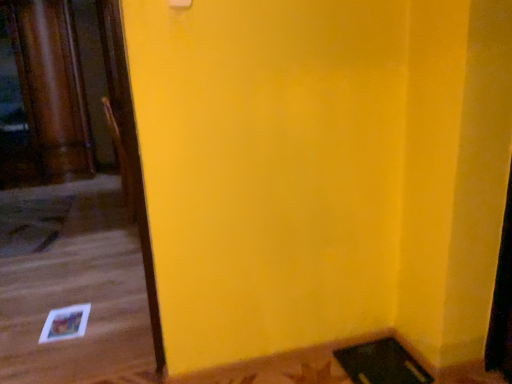
Identify the location of rug at lower left. (31, 223).

The width and height of the screenshot is (512, 384). What do you see at coordinates (31, 223) in the screenshot? I see `rug at lower left` at bounding box center [31, 223].

Looking at this image, what is the approximate height of wooden chair at left?

It is 38.28 inches.

This screenshot has width=512, height=384. Describe the element at coordinates (121, 160) in the screenshot. I see `wooden chair at left` at that location.

The image size is (512, 384). I want to click on wooden chair at left, so click(121, 160).

Measure the distance between point (x=131, y=209) and camera.

The distance of point (x=131, y=209) from camera is 3.31 meters.

Where is `rug at lower left`? rug at lower left is located at coordinates (31, 223).

Considering the relative positions of wooden chair at left and rug at lower left in the image provided, is wooden chair at left to the left of rug at lower left from the viewer's perspective?

Incorrect, wooden chair at left is not on the left side of rug at lower left.

Which is in front, wooden chair at left or rug at lower left?

Positioned in front is rug at lower left.

Which is behind, point (123, 171) or point (47, 214)?

The point (47, 214) is farther from the camera.

Based on the photo, from the image's perspective, is wooden chair at left above rug at lower left?

Yes, from the image's perspective, wooden chair at left is on top of rug at lower left.

Consider the image. From a real-world perspective, who is located higher, wooden chair at left or rug at lower left?

From a 3D spatial view, wooden chair at left is above.

Between wooden chair at left and rug at lower left, which one has larger width?

rug at lower left is wider.

Who is taller, wooden chair at left or rug at lower left?

wooden chair at left is taller.

Considering the sizes of objects wooden chair at left and rug at lower left in the image provided, who is bigger, wooden chair at left or rug at lower left?

Bigger between the two is wooden chair at left.

Is wooden chair at left not within rug at lower left?

Yes, wooden chair at left is outside of rug at lower left.

Is wooden chair at left next to rug at lower left?

wooden chair at left and rug at lower left are not in contact.

Is rug at lower left at the back of wooden chair at left?

Yes.

The height and width of the screenshot is (384, 512). What are the coordinates of `doormat directly beneath the wooden chair at left (from a real-world perspective)` in the screenshot? It's located at (31, 223).

Can you confirm if rug at lower left is positioned to the right of wooden chair at left?

In fact, rug at lower left is to the left of wooden chair at left.

Which object is closer to the camera taking this photo, rug at lower left or wooden chair at left?

Positioned in front is rug at lower left.

Is point (54, 219) closer or farther from the camera than point (131, 187)?

Point (54, 219) appears to be farther away from the viewer than point (131, 187).

From the image's perspective, is rug at lower left located above or below wooden chair at left?

Based on their image positions, rug at lower left is located beneath wooden chair at left.

From a real-world perspective, between rug at lower left and wooden chair at left, who is vertically lower?

rug at lower left, from a real-world perspective.

Considering the sizes of objects rug at lower left and wooden chair at left in the image provided, who is wider, rug at lower left or wooden chair at left?

rug at lower left.

Based on the photo, between rug at lower left and wooden chair at left, which one has less height?

rug at lower left is shorter.

Which of these two, rug at lower left or wooden chair at left, is smaller?

Smaller between the two is rug at lower left.

Would you say rug at lower left contains wooden chair at left?

Definitely not — wooden chair at left is not inside rug at lower left.

Would you say rug at lower left is a long distance from wooden chair at left?

rug at lower left is far away from wooden chair at left.

Is wooden chair at left at the back of rug at lower left?

That's not correct — rug at lower left is not looking away from wooden chair at left.

Find the location of a particular element. This screenshot has width=512, height=384. chair located above the rug at lower left (from the image's perspective) is located at coordinates (121, 160).

At what (x,y) coordinates should I click in order to perform the action: click on chair above the rug at lower left (from the image's perspective). Please return your answer as a coordinate pair (x, y). Looking at the image, I should click on (121, 160).

Locate an element on the screen. The width and height of the screenshot is (512, 384). chair on the right of rug at lower left is located at coordinates (121, 160).